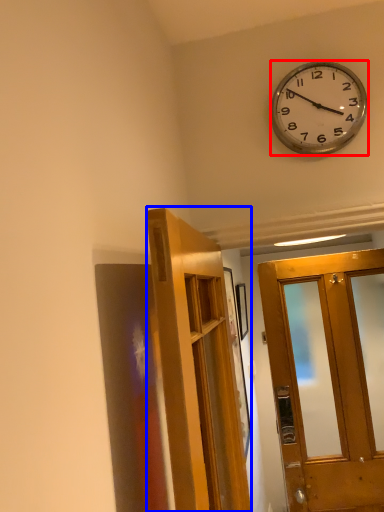
Question: Which of the following is the closest to the observer, wall clock (highlighted by a red box) or door (highlighted by a blue box)?

Choices:
 (A) wall clock
 (B) door

Answer: (B)